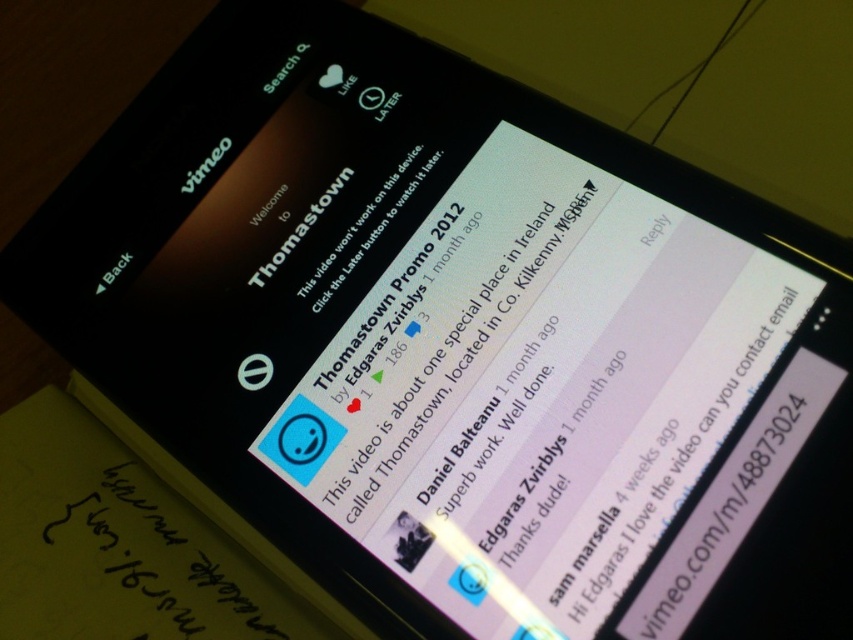
From the picture: You are trying to watch a video on your phone but see the white matte text message at center and the black paper at bottom left. Which object is closer to you?

The white matte text message at center is closer to you because it is in front of the black paper at bottom left.

You are trying to watch the video on the smartphone screen. There are two points on the screen at coordinates point (302, 492) and point (135, 545). Which point is closer to the top edge of the screen?

Point (135, 545) is closer to the top edge of the screen because its y coordinate is smaller, meaning it is positioned higher up on the screen.